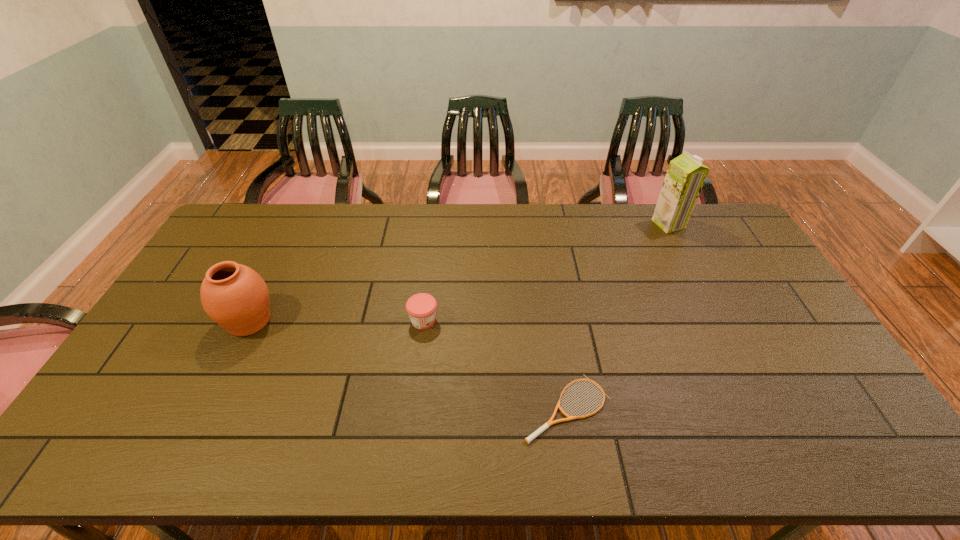
Image resolution: width=960 pixels, height=540 pixels. Find the location of `free spot between the jam and the tennis racket`. free spot between the jam and the tennis racket is located at coordinates 495,364.

Locate an element on the screen. The height and width of the screenshot is (540, 960). object that is the second nearest to the tallest object is located at coordinates (421, 307).

The width and height of the screenshot is (960, 540). What are the coordinates of `object that is the closest to the leftmost object` in the screenshot? It's located at (421, 307).

Where is `free location that satisfies the following two spatial constraints: 1. on the front side of the rightmost object; 2. on the front label of the jam`? The width and height of the screenshot is (960, 540). free location that satisfies the following two spatial constraints: 1. on the front side of the rightmost object; 2. on the front label of the jam is located at coordinates (717, 320).

The image size is (960, 540). I want to click on free point that satisfies the following two spatial constraints: 1. on the front label of the tennis racket; 2. on the left side of the jam, so click(x=413, y=408).

Where is `vacant region that satisfies the following two spatial constraints: 1. on the front label of the second shortest object; 2. on the front side of the third shortest object`? This screenshot has height=540, width=960. vacant region that satisfies the following two spatial constraints: 1. on the front label of the second shortest object; 2. on the front side of the third shortest object is located at coordinates (423, 321).

This screenshot has width=960, height=540. What are the coordinates of `vacant space that satisfies the following two spatial constraints: 1. on the front label of the third object from right to left; 2. on the back side of the shortest object` in the screenshot? It's located at (413, 408).